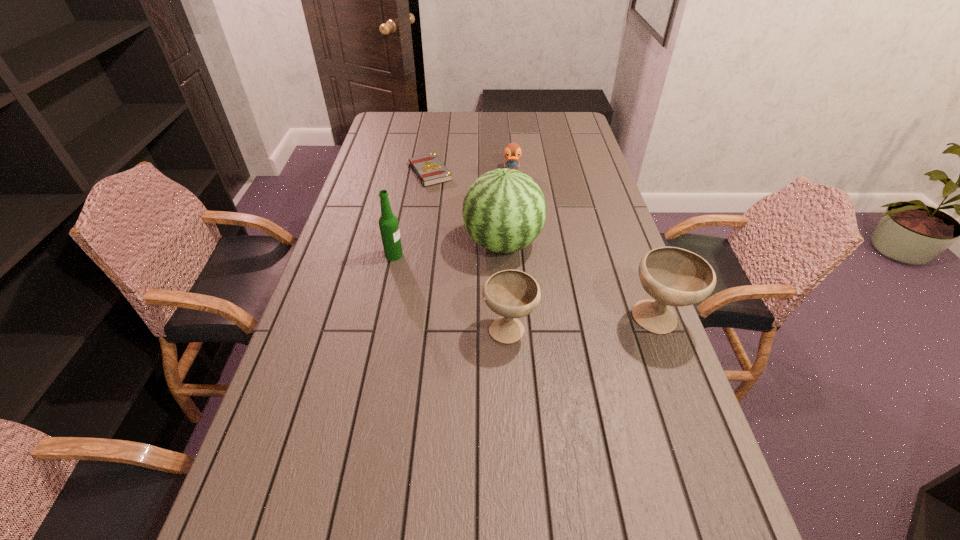
With all chalices evenly spaced, where should an extra chalice be placed on the left to continue the pattern? Please point out a vacant space. Please provide its 2D coordinates. Your answer should be formatted as a tuple, i.e. [(x, y)], where the tuple contains the x and y coordinates of a point satisfying the conditions above.

[(355, 337)]